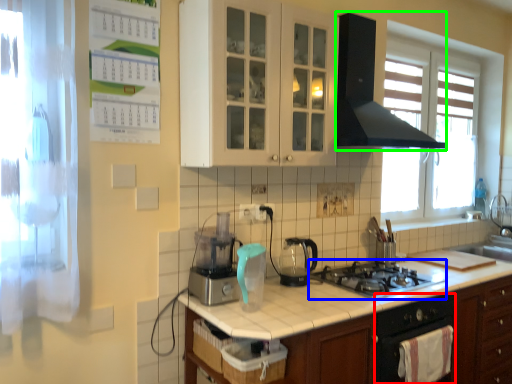
Question: Which object is positioned farthest from oven (highlighted by a red box)? Select from gas stove (highlighted by a blue box) and home appliance (highlighted by a green box).

Choices:
 (A) gas stove
 (B) home appliance

Answer: (B)